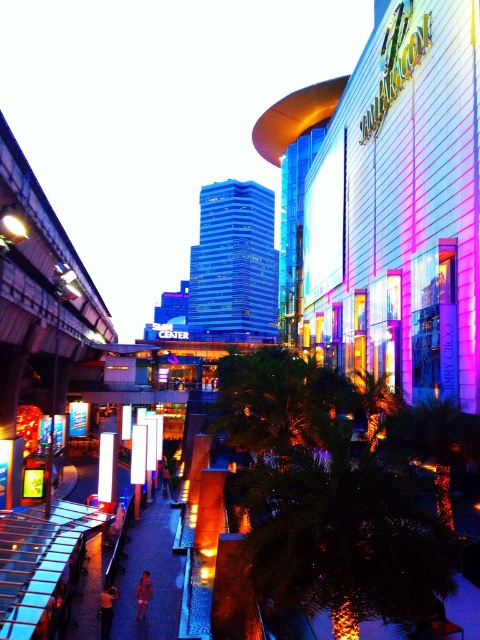
Find the location of `orange fabric shirt at lower left`. orange fabric shirt at lower left is located at coordinates (107, 609).

Which of these two, orange fabric shirt at lower left or pink fabric person at center, stands shorter?

Standing shorter between the two is orange fabric shirt at lower left.

Where is `orange fabric shirt at lower left`? orange fabric shirt at lower left is located at coordinates coord(107,609).